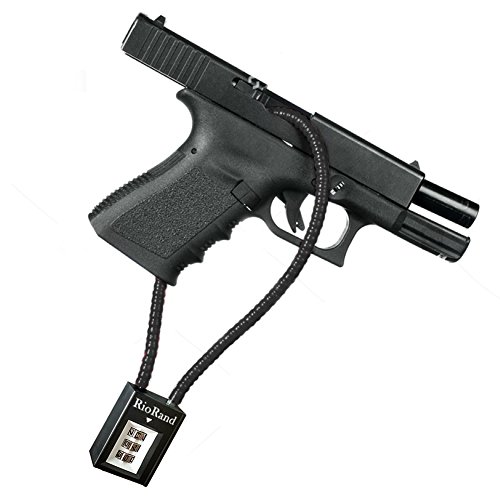
The width and height of the screenshot is (500, 500). What are the coordinates of `lock` in the screenshot? It's located at click(125, 406).